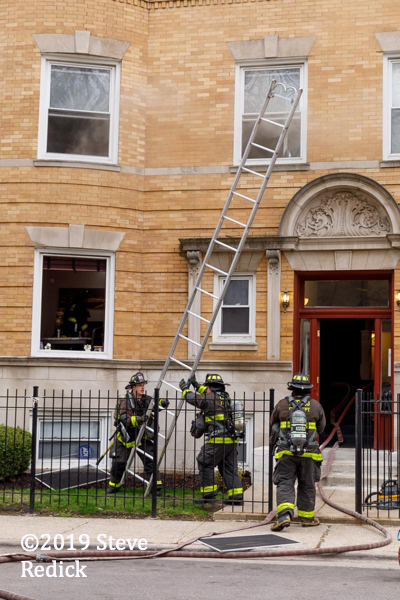
The image size is (400, 600). In order to click on steps in this screenshot , I will do `click(343, 463)`.